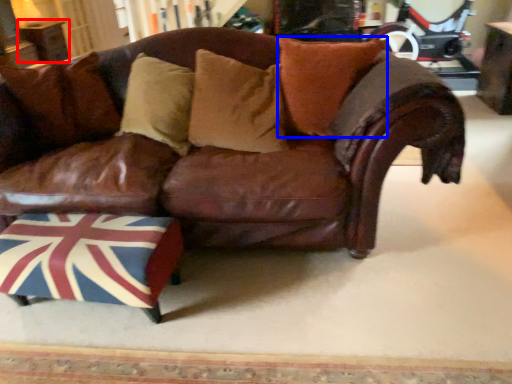
Question: Among these objects, which one is farthest to the camera, table (highlighted by a red box) or pillow (highlighted by a blue box)?

Choices:
 (A) table
 (B) pillow

Answer: (A)